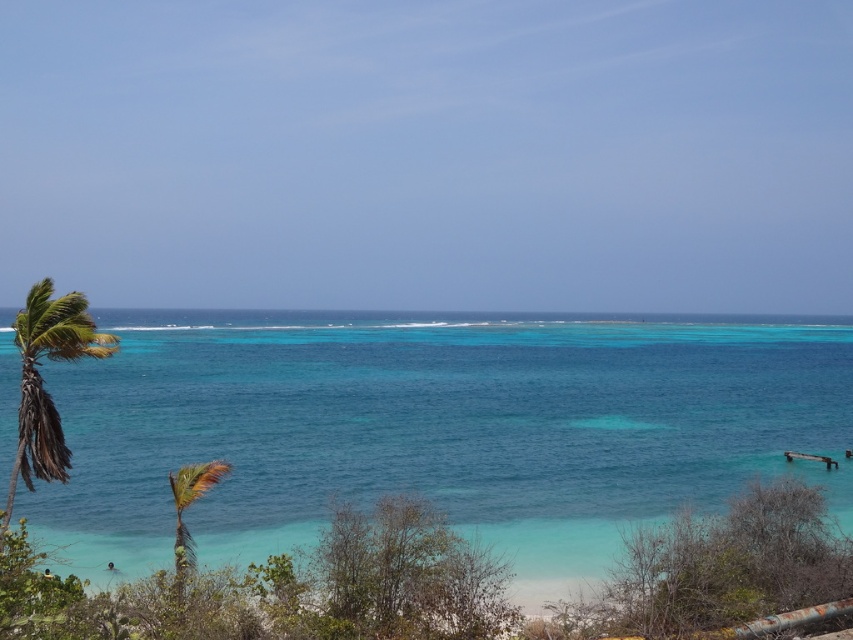
Between green leafy shrubs at lower center and green leafy palm tree at lower left, which one appears on the left side from the viewer's perspective?

green leafy palm tree at lower left

Does green leafy shrubs at lower center have a lesser height compared to green leafy palm tree at lower left?

Yes.

The image size is (853, 640). What are the coordinates of `green leafy shrubs at lower center` in the screenshot? It's located at (282, 588).

Locate an element on the screen. green leafy shrubs at lower center is located at coordinates (282, 588).

Does clear blue water at center come behind green leafy shrubs at lower center?

Yes, clear blue water at center is further from the viewer.

Between clear blue water at center and green leafy shrubs at lower center, which one appears on the right side from the viewer's perspective?

green leafy shrubs at lower center is more to the right.

Is point (86, 496) less distant than point (16, 584)?

No, it is behind (16, 584).

The width and height of the screenshot is (853, 640). I want to click on clear blue water at center, so click(436, 433).

Can you confirm if green leafy shrubs at lower center is wider than green leafy palm tree at left?

Correct, the width of green leafy shrubs at lower center exceeds that of green leafy palm tree at left.

Which is above, green leafy shrubs at lower center or green leafy palm tree at left?

Positioned higher is green leafy palm tree at left.

Does point (705, 612) come in front of point (12, 467)?

That is True.

Image resolution: width=853 pixels, height=640 pixels. I want to click on green leafy shrubs at lower center, so click(282, 588).